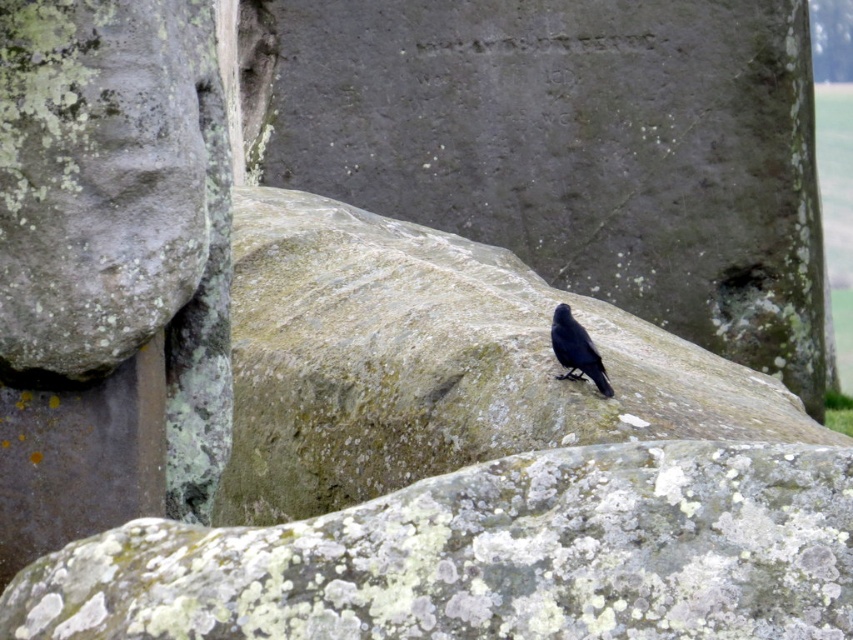
You are a photographer trying to capture the shiny black crow at center and the smooth gray rock at center in the same frame. Based on their positions, which object should you focus on first to ensure both are in focus?

The smooth gray rock at center is below the shiny black crow at center, so you should focus on the shiny black crow at center first to ensure both are in focus.

You are standing in front of the ancient stone structure. You notice a point marked at coordinates (489, 557). What object is located at that point?

The speckled gray rock at center is located at point (489, 557).

You are a birdwatcher standing near the speckled gray rock at center. You want to observe the shiny black crow at center without disturbing it. Considering the distance between them, what is the minimum distance you should maintain to ensure you don

The minimum distance you should maintain is 14.03 feet to ensure you stay at least as far as the existing distance between the speckled gray rock at center and the shiny black crow at center.